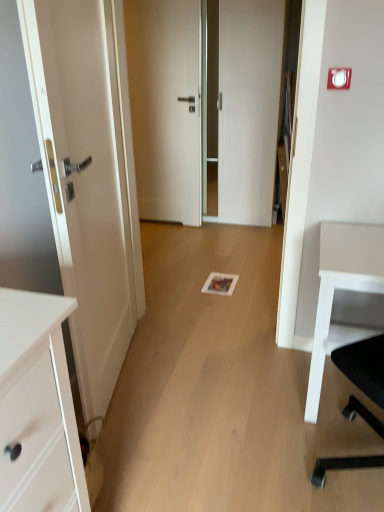
Locate an element on the screen. The height and width of the screenshot is (512, 384). free point in front of white glossy door at left, positioned as the 1th door in front-to-back order is located at coordinates (164, 442).